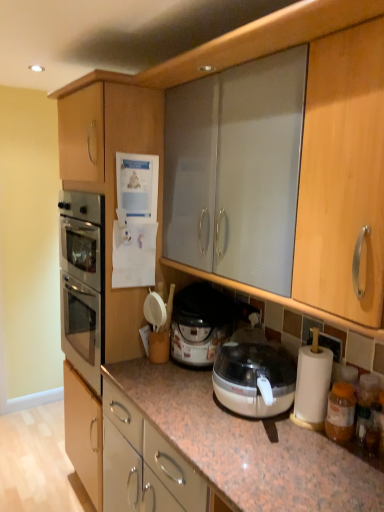
Question: From their relative heights in the image, would you say translucent plastic rice cooker at center is taller or shorter than matte wood cabinet at left?

Choices:
 (A) short
 (B) tall

Answer: (A)

Question: Looking at the image, does translucent plastic rice cooker at center seem bigger or smaller compared to matte wood cabinet at left?

Choices:
 (A) big
 (B) small

Answer: (B)

Question: In terms of width, does translucent plastic rice cooker at center look wider or thinner when compared to matte wood cabinet at left?

Choices:
 (A) wide
 (B) thin

Answer: (B)

Question: Considering the positions of point (74, 188) and point (183, 322), is point (74, 188) closer or farther from the camera than point (183, 322)?

Choices:
 (A) farther
 (B) closer

Answer: (A)

Question: Is matte wood cabinet at left spatially inside translucent plastic rice cooker at center, or outside of it?

Choices:
 (A) inside
 (B) outside

Answer: (B)

Question: From the image's perspective, is matte wood cabinet at left above or below translucent plastic rice cooker at center?

Choices:
 (A) above
 (B) below

Answer: (A)

Question: Relative to translucent plastic rice cooker at center, is matte wood cabinet at left in front or behind?

Choices:
 (A) front
 (B) behind

Answer: (A)